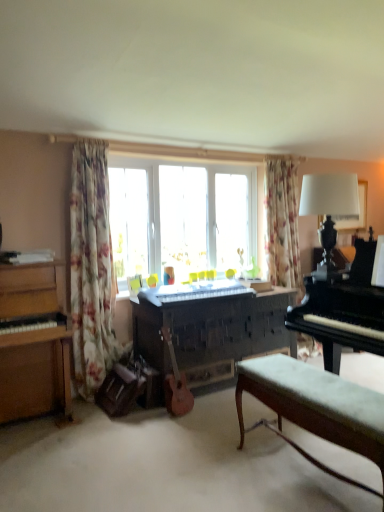
In order to click on free space in front of dark wood piano at center, which is counted as the second piano, starting from the right in this screenshot , I will do `click(191, 437)`.